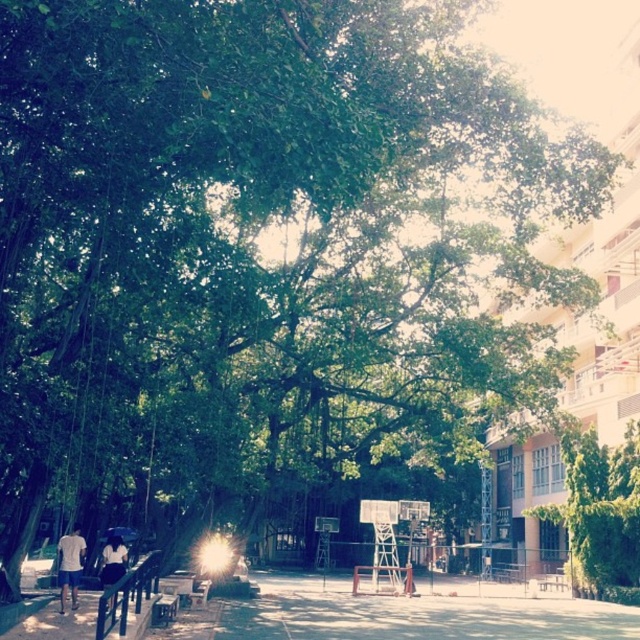
You are standing at the point with coordinates point (108, 572) and want to walk towards the point with coordinates point (388, 563). According to the scene description, will the basketball hoop block your path?

Point (388, 563) is behind point (108, 572), so the basketball hoop will block your path.

You are a visitor in the park and want to sit on the wooden park bench at lower center. Can you see the top of the green leafy tree at center from there?

The green leafy tree at center is not as tall as wooden park bench at lower center, so you can see the top of the green leafy tree at center from the wooden park bench at lower center.

You are a painter who needs to paint the metallic silver basketball hoop at center and the white cotton shirt at lower left. Which object requires a taller ladder?

The metallic silver basketball hoop at center requires a taller ladder because it is taller than the white cotton shirt at lower left.